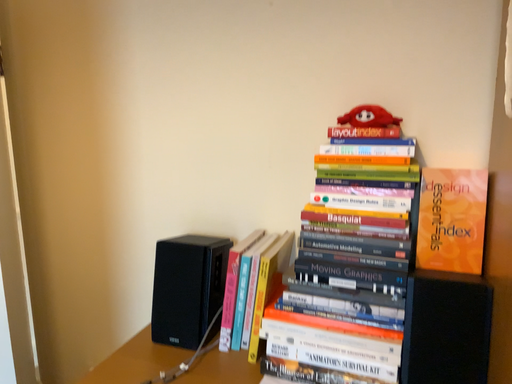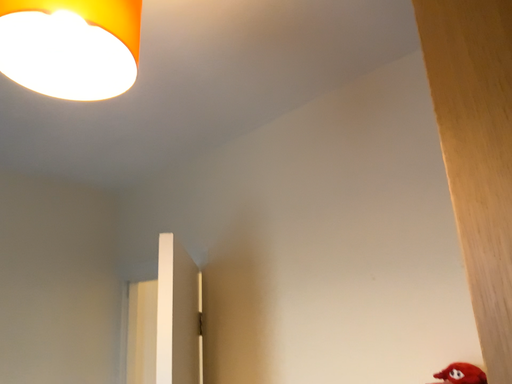
Question: Which way did the camera rotate in the video?

Choices:
 (A) rotated upward
 (B) rotated downward

Answer: (A)